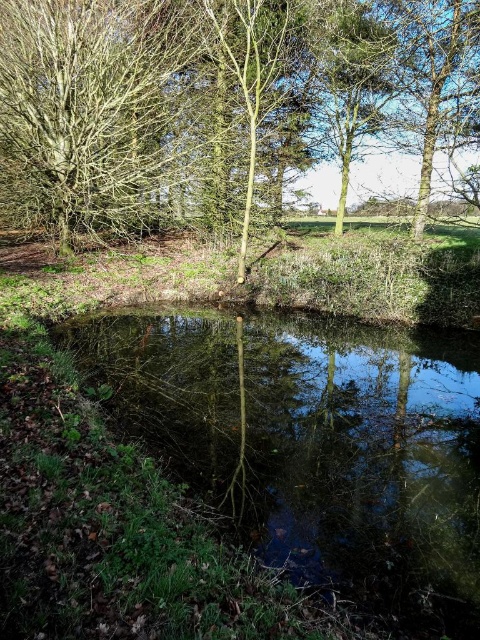
You are standing in the serene natural scene with the pond. You see two points marked in the image. Which point is closer to you, point (45, 44) or point (303, 381)?

Point (45, 44) is closer to you because it is further to the viewer than point (303, 381).

You are a hiker who wants to cross the green reflective water at center without getting your boots wet. There is a green matte tree at center nearby. Can you use the tree to reach the other side of the water?

The distance between the green matte tree at center and the green reflective water at center is 11.48 meters. Since the tree is 11.48 meters away from the water, it is not close enough to use as a bridge or stepping stone to cross the water without getting your boots wet.